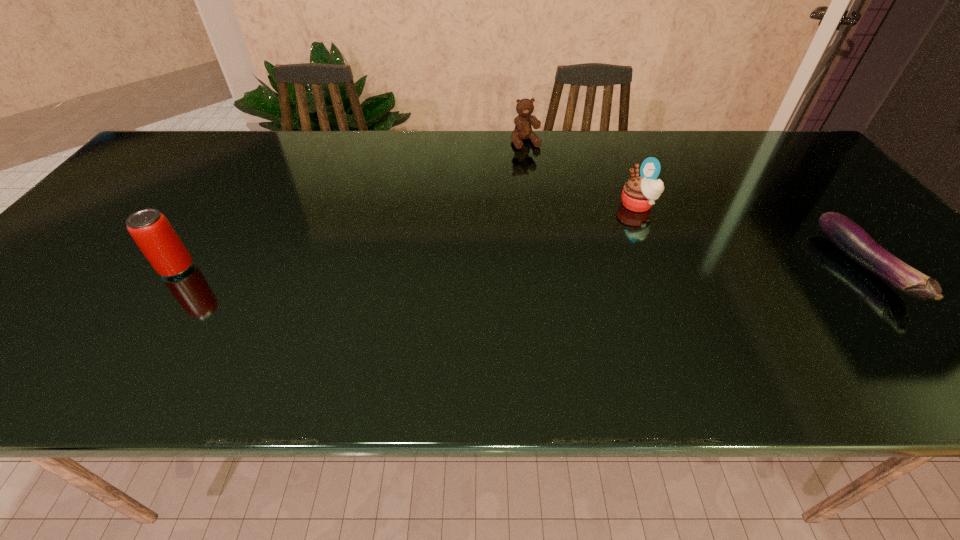
Locate an element on the screen. Image resolution: width=960 pixels, height=540 pixels. free space at the near edge of the desktop is located at coordinates (516, 313).

Find the location of a particular element. Image resolution: width=960 pixels, height=540 pixels. free space at the left edge of the desktop is located at coordinates (99, 228).

Locate an element on the screen. The image size is (960, 540). vacant space at the right edge of the desktop is located at coordinates (841, 189).

In the image, there is a desktop. Where is `vacant space at the far left corner`? This screenshot has height=540, width=960. vacant space at the far left corner is located at coordinates (213, 144).

Image resolution: width=960 pixels, height=540 pixels. I want to click on free space at the far right corner, so pos(767,139).

Find the location of a particular element. Image resolution: width=960 pixels, height=540 pixels. unoccupied position between the muffin and the rightmost object is located at coordinates (751, 237).

Locate an element on the screen. The width and height of the screenshot is (960, 540). free space between the second object from right to left and the third object from right to left is located at coordinates (582, 174).

The width and height of the screenshot is (960, 540). Identify the location of vacant space that is in between the rightmost object and the beer can. (520, 268).

Identify the location of free space between the second object from left to right and the beer can. (351, 205).

I want to click on vacant space that's between the rightmost object and the third object from left to right, so click(x=751, y=237).